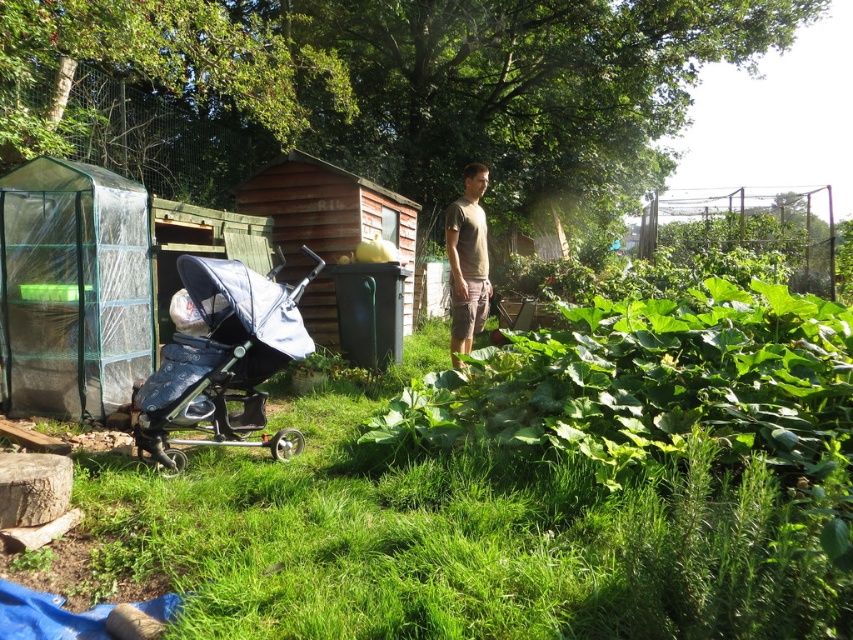
Question: Can you confirm if blue fabric stroller at left is positioned above light brown cotton t-shirt at center?

Choices:
 (A) no
 (B) yes

Answer: (A)

Question: Considering the real-world distances, which object is closest to the wooden shed at center?

Choices:
 (A) light brown cotton t-shirt at center
 (B) blue fabric stroller at left

Answer: (A)

Question: Is wooden shed at center positioned before light brown cotton t-shirt at center?

Choices:
 (A) no
 (B) yes

Answer: (A)

Question: Observing the image, what is the correct spatial positioning of blue fabric stroller at left in reference to light brown cotton t-shirt at center?

Choices:
 (A) left
 (B) right

Answer: (A)

Question: Which point is closer to the camera?

Choices:
 (A) light brown cotton t-shirt at center
 (B) blue fabric stroller at left
 (C) wooden shed at center

Answer: (B)

Question: Considering the real-world distances, which object is closest to the light brown cotton t-shirt at center?

Choices:
 (A) blue fabric stroller at left
 (B) wooden shed at center

Answer: (A)